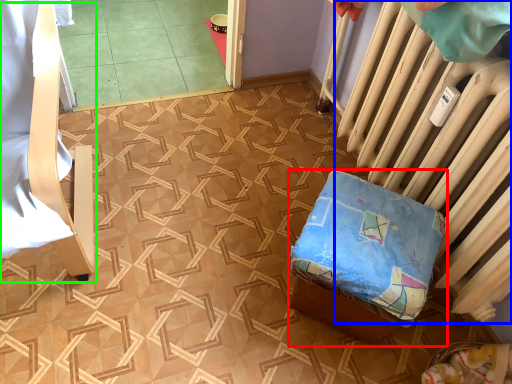
Question: Which object is the farthest from furniture (highlighted by a red box)? Choose among these: radiator (highlighted by a blue box) or furniture (highlighted by a green box).

Choices:
 (A) radiator
 (B) furniture

Answer: (B)